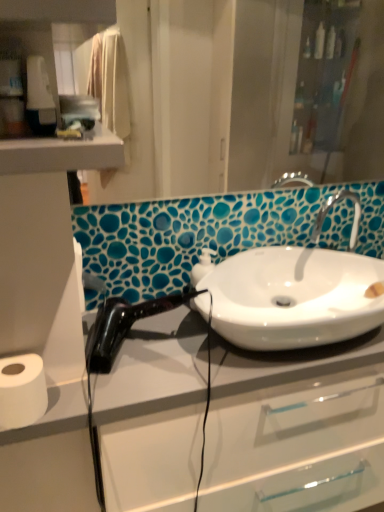
Question: Is white glossy sink at center at the left side of black glossy hair dryer at left?

Choices:
 (A) yes
 (B) no

Answer: (B)

Question: Is white glossy sink at center oriented away from black glossy hair dryer at left?

Choices:
 (A) yes
 (B) no

Answer: (B)

Question: Considering the relative sizes of white glossy sink at center and black glossy hair dryer at left in the image provided, is white glossy sink at center taller than black glossy hair dryer at left?

Choices:
 (A) yes
 (B) no

Answer: (B)

Question: Does white glossy sink at center turn towards black glossy hair dryer at left?

Choices:
 (A) yes
 (B) no

Answer: (B)

Question: From a real-world perspective, is white glossy sink at center on black glossy hair dryer at left?

Choices:
 (A) no
 (B) yes

Answer: (B)

Question: From a real-world perspective, is white glossy sink at center beneath black glossy hair dryer at left?

Choices:
 (A) no
 (B) yes

Answer: (A)

Question: Is white matte toilet paper at lower left to the left of matte glass mirror at upper center from the viewer's perspective?

Choices:
 (A) yes
 (B) no

Answer: (A)

Question: From the image's perspective, is white matte toilet paper at lower left below matte glass mirror at upper center?

Choices:
 (A) no
 (B) yes

Answer: (B)

Question: Is white matte toilet paper at lower left not close to matte glass mirror at upper center?

Choices:
 (A) yes
 (B) no

Answer: (A)

Question: Is white matte toilet paper at lower left next to matte glass mirror at upper center?

Choices:
 (A) no
 (B) yes

Answer: (A)

Question: Can you confirm if white matte toilet paper at lower left is shorter than matte glass mirror at upper center?

Choices:
 (A) yes
 (B) no

Answer: (A)

Question: Is white matte toilet paper at lower left facing away from matte glass mirror at upper center?

Choices:
 (A) no
 (B) yes

Answer: (A)

Question: Considering the relative sizes of white glossy sink at center and white matte toilet paper at lower left in the image provided, is white glossy sink at center smaller than white matte toilet paper at lower left?

Choices:
 (A) yes
 (B) no

Answer: (B)